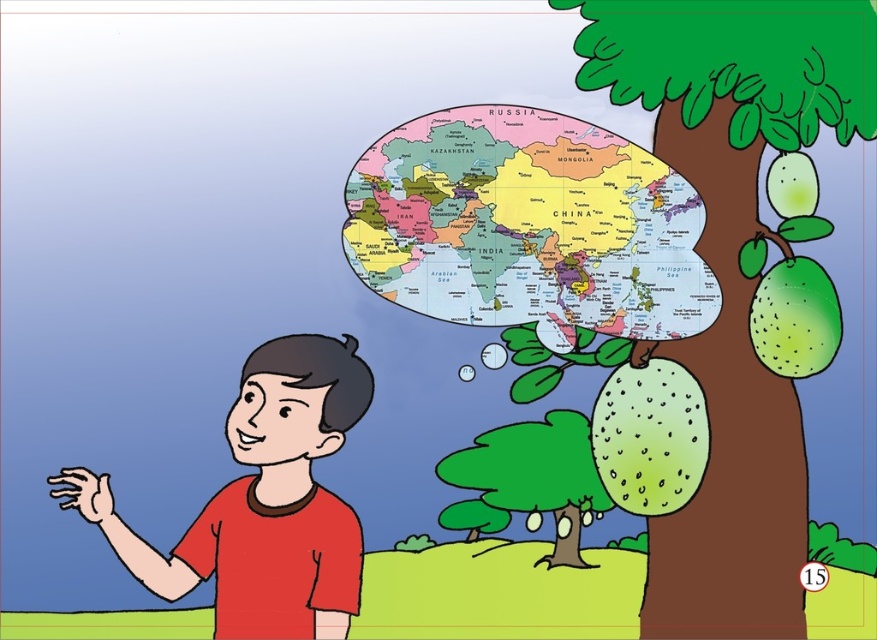
Who is positioned more to the left, colorful paper map at upper center or green matte tree at center?

Positioned to the left is green matte tree at center.

Who is shorter, colorful paper map at upper center or green matte tree at center?

Standing shorter between the two is green matte tree at center.

Image resolution: width=877 pixels, height=640 pixels. Describe the element at coordinates (528, 225) in the screenshot. I see `colorful paper map at upper center` at that location.

Where is `colorful paper map at upper center`? This screenshot has height=640, width=877. colorful paper map at upper center is located at coordinates (528, 225).

In the scene shown: Which is more to the left, green leafy tree at upper right or green matte tree at center?

Positioned to the left is green matte tree at center.

Does green leafy tree at upper right come in front of green matte tree at center?

Yes, it is.

Is point (707, 506) farther from viewer compared to point (543, 477)?

No.

You are a GUI agent. You are given a task and a screenshot of the screen. Output one action in this format:
    pyautogui.click(x=<x>, y=<y>)
    Task: Click on the green leafy tree at upper right
    Image resolution: width=877 pixels, height=640 pixels.
    Given the screenshot: What is the action you would take?
    pyautogui.click(x=732, y=273)

Describe the element at coordinates (528, 225) in the screenshot. I see `colorful paper map at upper center` at that location.

Is colorful paper map at upper center smaller than matte red shirt at left?

Yes, colorful paper map at upper center is smaller than matte red shirt at left.

What do you see at coordinates (528, 225) in the screenshot? I see `colorful paper map at upper center` at bounding box center [528, 225].

The height and width of the screenshot is (640, 877). Find the location of `colorful paper map at upper center`. colorful paper map at upper center is located at coordinates (528, 225).